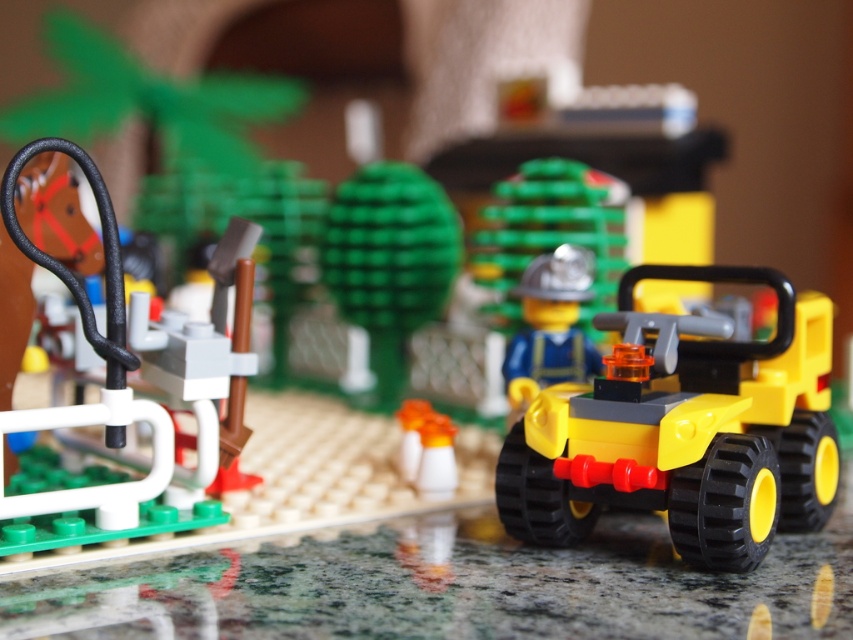
Looking at this image, between black rubber hose at left and blue matte figure at center, which one appears on the left side from the viewer's perspective?

black rubber hose at left is more to the left.

Which is below, black rubber hose at left or blue matte figure at center?

black rubber hose at left

What do you see at coordinates (117, 388) in the screenshot? The height and width of the screenshot is (640, 853). I see `black rubber hose at left` at bounding box center [117, 388].

Where is `black rubber hose at left`? This screenshot has height=640, width=853. black rubber hose at left is located at coordinates (117, 388).

Is point (606, 444) less distant than point (561, 340)?

Yes, it is.

Does yellow plastic atv at center-right have a lesser width compared to blue matte figure at center?

No, yellow plastic atv at center-right is not thinner than blue matte figure at center.

You are a GUI agent. You are given a task and a screenshot of the screen. Output one action in this format:
    pyautogui.click(x=<x>, y=<y>)
    Task: Click on the yellow plastic atv at center-right
    Image resolution: width=853 pixels, height=640 pixels.
    Given the screenshot: What is the action you would take?
    click(682, 433)

Locate an element on the screen. The width and height of the screenshot is (853, 640). yellow plastic atv at center-right is located at coordinates (682, 433).

Does yellow plastic atv at center-right have a lesser width compared to black rubber hose at left?

No.

Does point (824, 326) lie in front of point (64, 508)?

No.

At what (x,y) coordinates should I click in order to perform the action: click on yellow plastic atv at center-right. Please return your answer as a coordinate pair (x, y). The width and height of the screenshot is (853, 640). Looking at the image, I should click on (682, 433).